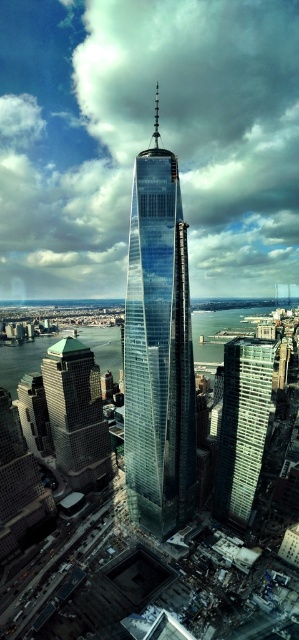
You are a drone operator trying to navigate between the glassy steel skyscraper at center and the green glass building at lower left. According to the scene, which building should you fly towards first to stay on the correct path?

You should fly towards the green glass building at lower left first because the glassy steel skyscraper at center is to the right of it, so approaching from the left side would keep you on the correct path.

You are a city planner analyzing the central area of the city. You observe the transparent glass skyscraper at center and the glassy steel skyscraper at center. Which one has a greater width according to the available data?

The transparent glass skyscraper at center might be wider than the glassy steel skyscraper at center according to the available data.